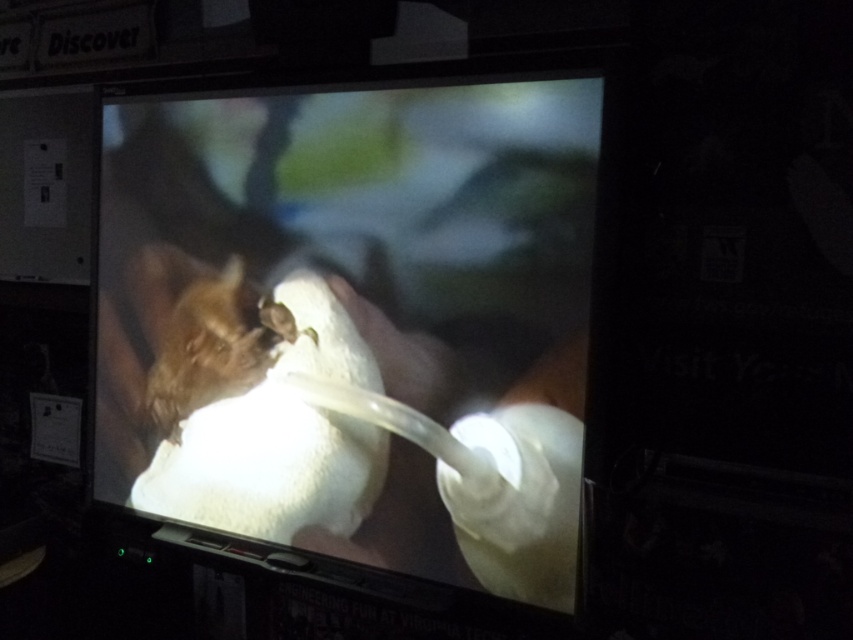
Is white plastic bottle at center to the right of brown fur animal at center from the viewer's perspective?

Yes, white plastic bottle at center is to the right of brown fur animal at center.

Is point (334, 186) positioned behind point (265, 348)?

No, (334, 186) is in front of (265, 348).

Which is in front, point (453, 218) or point (236, 368)?

Point (453, 218) is in front.

You are a GUI agent. You are given a task and a screenshot of the screen. Output one action in this format:
    pyautogui.click(x=<x>, y=<y>)
    Task: Click on the white plastic bottle at center
    
    Given the screenshot: What is the action you would take?
    pyautogui.click(x=352, y=321)